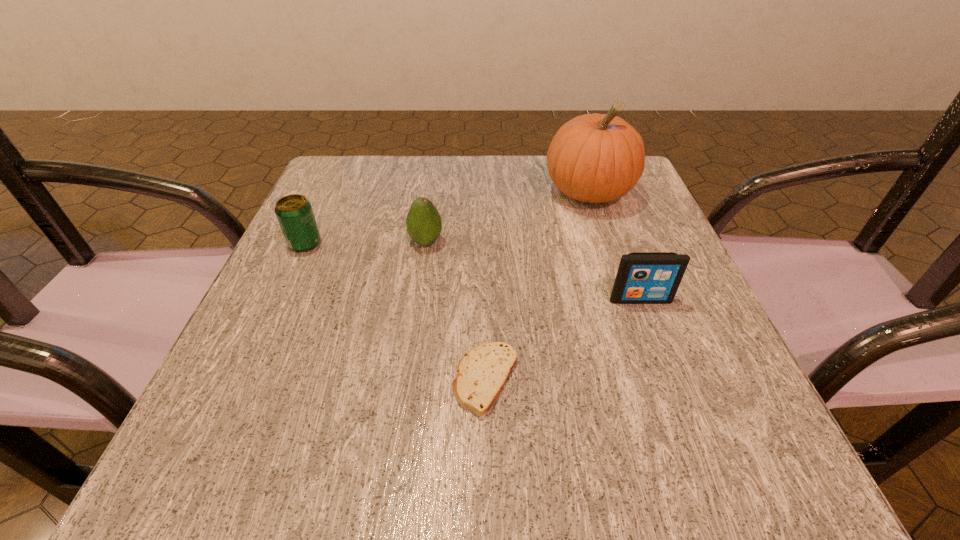
This screenshot has width=960, height=540. I want to click on pumpkin, so click(x=594, y=158).

Where is `the tallest object`? The image size is (960, 540). the tallest object is located at coordinates (594, 158).

Find the location of a particular element. The width and height of the screenshot is (960, 540). avocado is located at coordinates (423, 223).

This screenshot has width=960, height=540. I want to click on iPod, so click(x=643, y=277).

Where is `beer can`? This screenshot has height=540, width=960. beer can is located at coordinates (294, 212).

Find the location of `the nearest object`. the nearest object is located at coordinates (482, 373).

This screenshot has width=960, height=540. In order to click on the third object from right to left in this screenshot , I will do (482, 373).

I want to click on vacant space located on the stem of the tallest object, so click(x=652, y=382).

At what (x,y) coordinates should I click in order to perform the action: click on free point located on the right of the second object from left to right. Please return your answer as a coordinate pair (x, y). Looking at the image, I should click on (515, 242).

Where is `blank space located 0.250m on the front screen of the second nearest object`? The width and height of the screenshot is (960, 540). blank space located 0.250m on the front screen of the second nearest object is located at coordinates (695, 447).